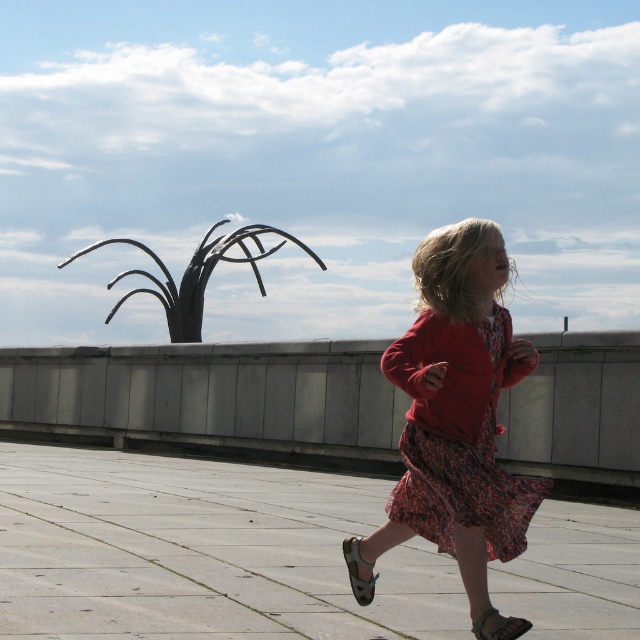
Is point (440, 358) closer to camera compared to point (257, 276)?

Yes, point (440, 358) is closer to viewer.

Is floral cotton dress at center shorter than black metal sculpture at upper center?

Yes, floral cotton dress at center is shorter than black metal sculpture at upper center.

Does point (426, 342) lie behind point (129, 243)?

That is False.

You are a GUI agent. You are given a task and a screenshot of the screen. Output one action in this format:
    pyautogui.click(x=<x>, y=<y>)
    Task: Click on the floral cotton dress at center
    This screenshot has width=640, height=640.
    Given the screenshot: What is the action you would take?
    pyautogui.click(x=456, y=420)

Image resolution: width=640 pixels, height=640 pixels. Find the location of `smooth concrete pavement at center`. smooth concrete pavement at center is located at coordinates (202, 552).

Where is `smooth concrete pavement at center`? Image resolution: width=640 pixels, height=640 pixels. smooth concrete pavement at center is located at coordinates (202, 552).

Where is `smooth concrete pavement at center`? The height and width of the screenshot is (640, 640). smooth concrete pavement at center is located at coordinates (202, 552).

Does smooth concrete pavement at center come in front of black metal sculpture at upper center?

Yes, it is in front of black metal sculpture at upper center.

What are the coordinates of `smooth concrete pavement at center` in the screenshot? It's located at (202, 552).

The height and width of the screenshot is (640, 640). I want to click on smooth concrete pavement at center, so click(202, 552).